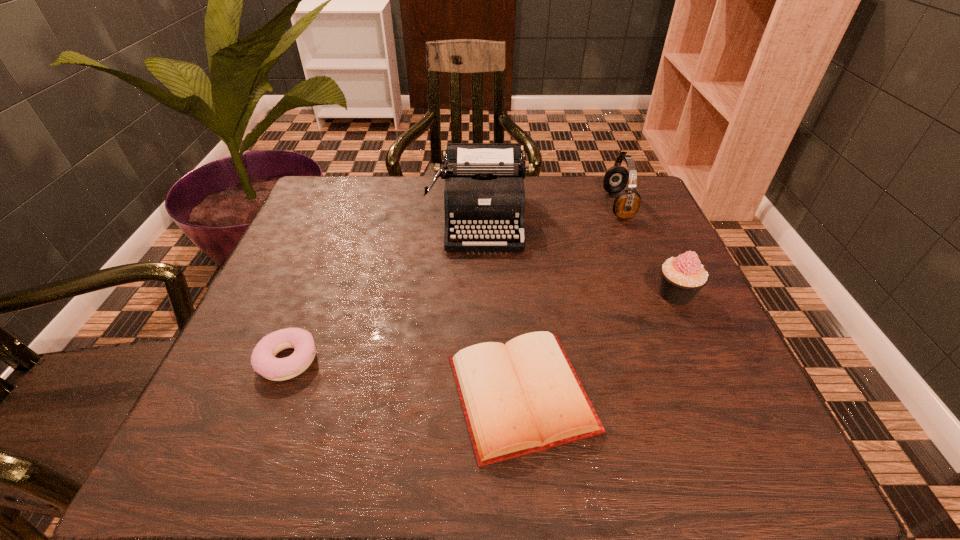
This screenshot has width=960, height=540. Find the location of `free space that satisfies the following two spatial constraints: 1. on the back side of the cupcake; 2. on the ear cups of the headset`. free space that satisfies the following two spatial constraints: 1. on the back side of the cupcake; 2. on the ear cups of the headset is located at coordinates (635, 205).

Find the location of a particular element. free spot that satisfies the following two spatial constraints: 1. on the ear cups of the headset; 2. on the typing side of the typewriter is located at coordinates (624, 219).

Locate an element on the screen. This screenshot has width=960, height=540. blank space that satisfies the following two spatial constraints: 1. on the ear cups of the headset; 2. on the front side of the shortest object is located at coordinates (695, 394).